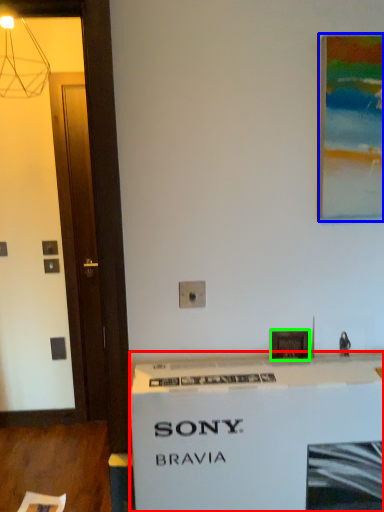
Question: Which object is positioned closest to counter (highlighted by a red box)? Select from picture frame (highlighted by a blue box) and picture frame (highlighted by a green box).

Choices:
 (A) picture frame
 (B) picture frame

Answer: (B)